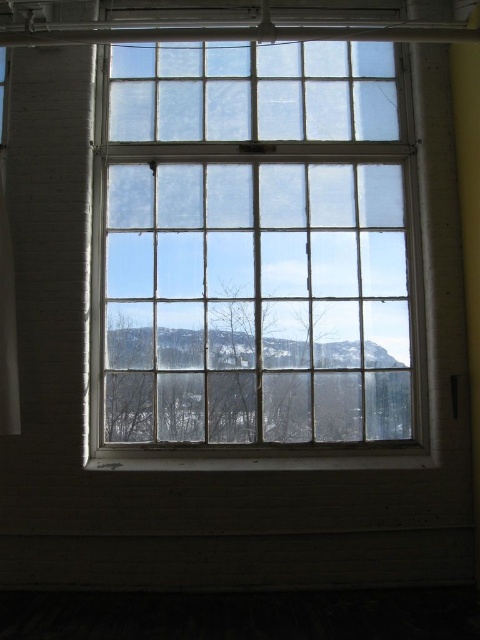
Is the position of clear glass window at center more distant than that of white sheer curtain at left?

Yes.

Which is behind, point (253, 433) or point (16, 362)?

Positioned behind is point (253, 433).

Is point (356, 77) farther from viewer compared to point (2, 342)?

Yes, point (356, 77) is behind point (2, 342).

Identify the location of clear glass window at center. The height and width of the screenshot is (640, 480). (254, 253).